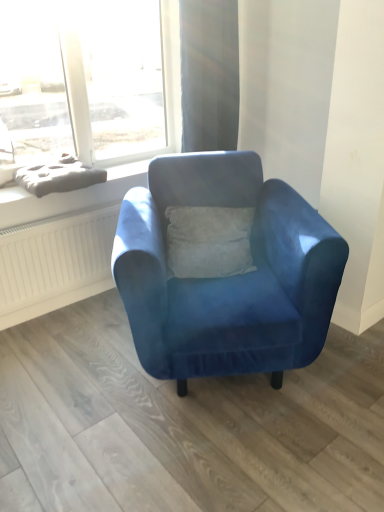
Question: Is gray fabric cushion at upper left spatially inside matte gray cushion at upper left, or outside of it?

Choices:
 (A) outside
 (B) inside

Answer: (A)

Question: Looking at the image, does gray fabric cushion at upper left seem bigger or smaller compared to matte gray cushion at upper left?

Choices:
 (A) big
 (B) small

Answer: (B)

Question: Considering the real-world distances, which object is farthest from the velvet blue armchair at center?

Choices:
 (A) matte gray cushion at upper left
 (B) gray fabric cushion at upper left
 (C) satin beige curtain at upper center

Answer: (C)

Question: Estimate the real-world distances between objects in this image. Which object is farther from the gray fabric cushion at upper left?

Choices:
 (A) velvet blue armchair at center
 (B) satin beige curtain at upper center
 (C) matte gray cushion at upper left

Answer: (A)